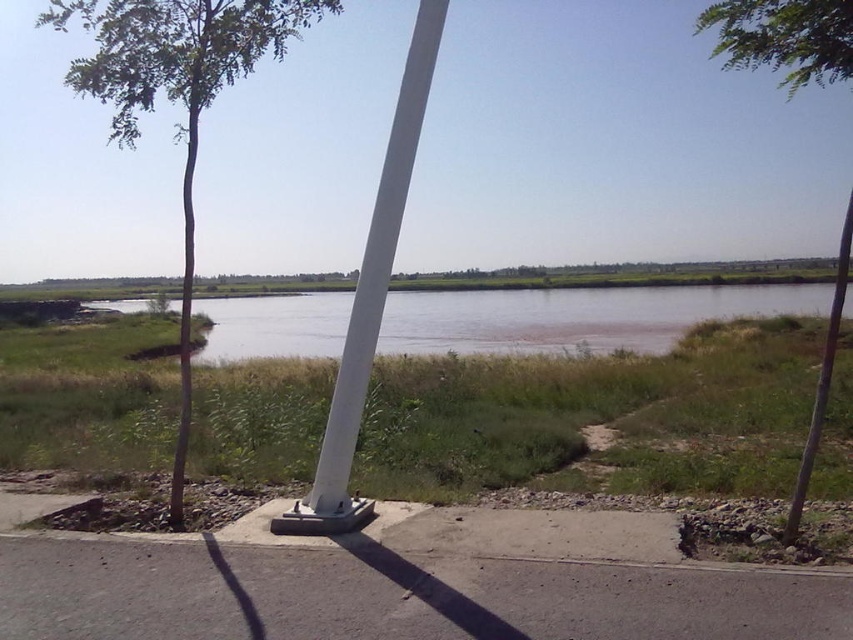
Is point (796, 627) less distant than point (445, 10)?

That is True.

Find the location of a particular element. gray asphalt pavement at lower center is located at coordinates (392, 595).

Is point (84, 577) more distant than point (341, 374)?

No, (84, 577) is in front of (341, 374).

Where is `gray asphalt pavement at lower center`? gray asphalt pavement at lower center is located at coordinates (392, 595).

Is point (595, 628) behind point (231, 48)?

No, it is not.

Does gray asphalt pavement at lower center have a lesser height compared to green leafy tree at left?

Yes.

Is point (67, 604) positioned after point (228, 65)?

No, it is in front of (228, 65).

Where is `gray asphalt pavement at lower center`? gray asphalt pavement at lower center is located at coordinates (392, 595).

How much distance is there between green leafy tree at left and green leafy tree at upper left?

green leafy tree at left and green leafy tree at upper left are 41.68 meters apart.

Is point (62, 19) positioned before point (834, 3)?

That is False.

Does point (67, 3) come closer to viewer compared to point (705, 17)?

That is False.

Locate an element on the screen. The height and width of the screenshot is (640, 853). green leafy tree at left is located at coordinates (177, 97).